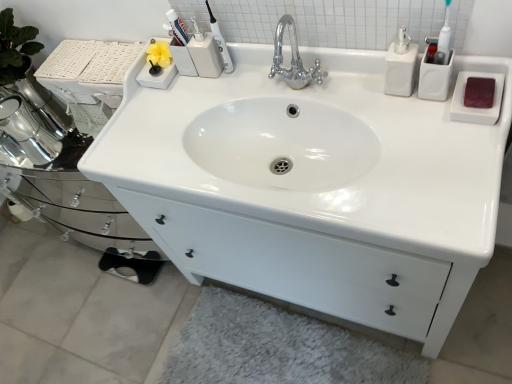
Image resolution: width=512 pixels, height=384 pixels. What do you see at coordinates (277, 348) in the screenshot? I see `white fluffy bath mat at lower center` at bounding box center [277, 348].

This screenshot has height=384, width=512. In order to click on matte plastic toothbrush at upper center in this screenshot , I will do `click(220, 42)`.

From the picture: Measure the distance between point (x=169, y=181) and camera.

A distance of 1.06 meters exists between point (x=169, y=181) and camera.

Image resolution: width=512 pixels, height=384 pixels. In order to click on white fluffy bath mat at lower center in this screenshot , I will do `click(277, 348)`.

Can you tell me how much white fluffy bath mat at lower center and white glossy sink at center differ in facing direction?

white fluffy bath mat at lower center and white glossy sink at center are facing 0.154 degrees away from each other.

Could you tell me if white fluffy bath mat at lower center is turned towards white glossy sink at center?

No, white fluffy bath mat at lower center is not aimed at white glossy sink at center.

Locate an element on the screen. bath mat that appears below the white glossy sink at center (from a real-world perspective) is located at coordinates (277, 348).

Consider the image. Considering the relative positions of white fluffy bath mat at lower center and white glossy sink at center in the image provided, is white fluffy bath mat at lower center to the left of white glossy sink at center from the viewer's perspective?

Yes, white fluffy bath mat at lower center is to the left of white glossy sink at center.

Is point (410, 81) less distant than point (184, 77)?

Yes, point (410, 81) is in front of point (184, 77).

Considering the positions of objects white glossy soap dispenser at upper right and white glossy sink at center in the image provided, who is more to the right, white glossy soap dispenser at upper right or white glossy sink at center?

From the viewer's perspective, white glossy soap dispenser at upper right appears more on the right side.

Between white glossy soap dispenser at upper right and white glossy sink at center, which one has more height?

With more height is white glossy sink at center.

Can you confirm if white glossy soap dispenser at upper right is smaller than white glossy sink at center?

Yes, white glossy soap dispenser at upper right is smaller than white glossy sink at center.

From the picture: How different are the orientations of matte plastic toothbrush at upper center and white glossy sink at center in degrees?

There is a 0.793-degree angle between the facing directions of matte plastic toothbrush at upper center and white glossy sink at center.

Does matte plastic toothbrush at upper center have a greater height compared to white glossy sink at center?

No.

Which is more to the right, matte plastic toothbrush at upper center or white glossy sink at center?

Positioned to the right is white glossy sink at center.

Would you say matte plastic toothbrush at upper center contains white glossy sink at center?

That's incorrect, white glossy sink at center is not inside matte plastic toothbrush at upper center.

Which of these two, matte plastic toothbrush at upper center or white fluffy bath mat at lower center, stands shorter?

With less height is white fluffy bath mat at lower center.

Would you say matte plastic toothbrush at upper center contains white fluffy bath mat at lower center?

Definitely not — white fluffy bath mat at lower center is not inside matte plastic toothbrush at upper center.

Looking at this image, from the image's perspective, is matte plastic toothbrush at upper center positioned above or below white fluffy bath mat at lower center?

matte plastic toothbrush at upper center is situated higher than white fluffy bath mat at lower center in the image.

Is matte plastic toothbrush at upper center in front of or behind white fluffy bath mat at lower center in the image?

Clearly, matte plastic toothbrush at upper center is in front of white fluffy bath mat at lower center.

Considering the relative sizes of white glossy sink at center and white glossy soap dispenser at upper right in the image provided, is white glossy sink at center smaller than white glossy soap dispenser at upper right?

No, white glossy sink at center is not smaller than white glossy soap dispenser at upper right.

Which point is more distant from viewer, (429,223) or (400,77)?

The point (400,77) is farther from the camera.

Is white glossy sink at center with white glossy soap dispenser at upper right?

No, white glossy sink at center is not touching white glossy soap dispenser at upper right.

In the scene shown: Is white fluffy bath mat at lower center located outside matte plastic toothbrush at upper center?

white fluffy bath mat at lower center lies outside matte plastic toothbrush at upper center's area.

From the image's perspective, does white fluffy bath mat at lower center appear higher than matte plastic toothbrush at upper center?

Incorrect, from the image's perspective, white fluffy bath mat at lower center is lower than matte plastic toothbrush at upper center.

Can you see white fluffy bath mat at lower center touching matte plastic toothbrush at upper center?

white fluffy bath mat at lower center is not next to matte plastic toothbrush at upper center, and they're not touching.

Does white fluffy bath mat at lower center have a lesser height compared to matte plastic toothbrush at upper center?

Yes, white fluffy bath mat at lower center is shorter than matte plastic toothbrush at upper center.

Which is correct: white glossy sink at center is inside white fluffy bath mat at lower center, or outside of it?

white glossy sink at center is spatially situated outside white fluffy bath mat at lower center.

Between point (131, 136) and point (396, 359), which one is positioned behind?

Positioned behind is point (396, 359).

Is white glossy sink at center wider than white fluffy bath mat at lower center?

Indeed, white glossy sink at center has a greater width compared to white fluffy bath mat at lower center.

The height and width of the screenshot is (384, 512). I want to click on sink in front of the white fluffy bath mat at lower center, so click(338, 186).

Identify the location of soap dispenser located on the right of white glossy sink at center. (400, 65).

Based on their spatial positions, is white glossy soap dispenser at upper right or white glossy sink at center closer to white fluffy bath mat at lower center?

Among the two, white glossy sink at center is located nearer to white fluffy bath mat at lower center.

In the scene shown: Estimate the real-world distances between objects in this image. Which object is closer to white glossy soap dispenser at upper right, matte plastic toothbrush at upper center or white fluffy bath mat at lower center?

Among the two, matte plastic toothbrush at upper center is located nearer to white glossy soap dispenser at upper right.

Based on their spatial positions, is white glossy sink at center or matte plastic toothbrush at upper center closer to white fluffy bath mat at lower center?

Based on the image, white glossy sink at center appears to be nearer to white fluffy bath mat at lower center.

Looking at the image, which one is located further to white fluffy bath mat at lower center, white glossy soap dispenser at upper right or matte plastic toothbrush at upper center?

white glossy soap dispenser at upper right is further to white fluffy bath mat at lower center.

Estimate the real-world distances between objects in this image. Which object is further from matte plastic toothbrush at upper center, white glossy soap dispenser at upper right or white fluffy bath mat at lower center?

white fluffy bath mat at lower center is positioned further to the anchor matte plastic toothbrush at upper center.

Based on their spatial positions, is white fluffy bath mat at lower center or matte plastic toothbrush at upper center closer to white glossy sink at center?

matte plastic toothbrush at upper center is closer to white glossy sink at center.

Estimate the real-world distances between objects in this image. Which object is further from white fluffy bath mat at lower center, matte plastic toothbrush at upper center or white glossy soap dispenser at upper right?

white glossy soap dispenser at upper right is further to white fluffy bath mat at lower center.

Considering their positions, is white glossy soap dispenser at upper right positioned closer to matte plastic toothbrush at upper center than white glossy sink at center?

Among the two, white glossy sink at center is located nearer to matte plastic toothbrush at upper center.

Find the location of a particular element. Image resolution: width=512 pixels, height=384 pixels. sink between matte plastic toothbrush at upper center and white fluffy bath mat at lower center vertically is located at coordinates (338, 186).

At what (x,y) coordinates should I click in order to perform the action: click on soap dispenser between matte plastic toothbrush at upper center and white fluffy bath mat at lower center in the up-down direction. Please return your answer as a coordinate pair (x, y). Looking at the image, I should click on (400, 65).

In order to click on sink between white glossy soap dispenser at upper right and white fluffy bath mat at lower center in the up-down direction in this screenshot , I will do `click(338, 186)`.

This screenshot has width=512, height=384. What are the coordinates of `soap dispenser between matte plastic toothbrush at upper center and white glossy sink at center from top to bottom` in the screenshot? It's located at (400, 65).